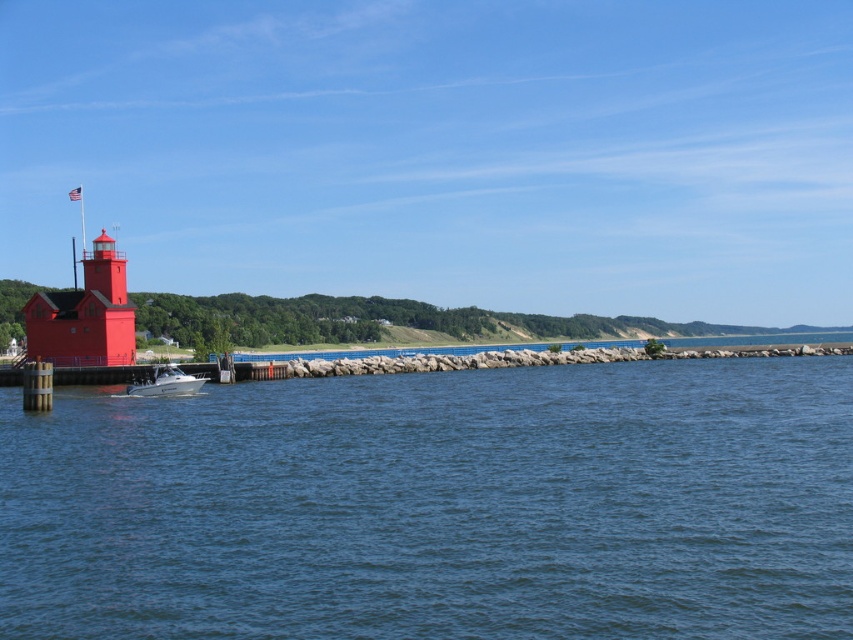
Question: Which point is closer to the camera taking this photo?

Choices:
 (A) (173, 369)
 (B) (134, 349)
 (C) (805, 380)

Answer: (C)

Question: Does blue water at center appear on the right side of white glossy boat at lower left?

Choices:
 (A) no
 (B) yes

Answer: (B)

Question: Estimate the real-world distances between objects in this image. Which object is closer to the white glossy boat at lower left?

Choices:
 (A) blue water at center
 (B) matte red lighthouse at left

Answer: (A)

Question: Is matte red lighthouse at left positioned at the back of white glossy boat at lower left?

Choices:
 (A) yes
 (B) no

Answer: (A)

Question: Which object is the closest to the blue water at center?

Choices:
 (A) matte red lighthouse at left
 (B) white glossy boat at lower left

Answer: (B)

Question: Is blue water at center further to camera compared to white glossy boat at lower left?

Choices:
 (A) no
 (B) yes

Answer: (A)